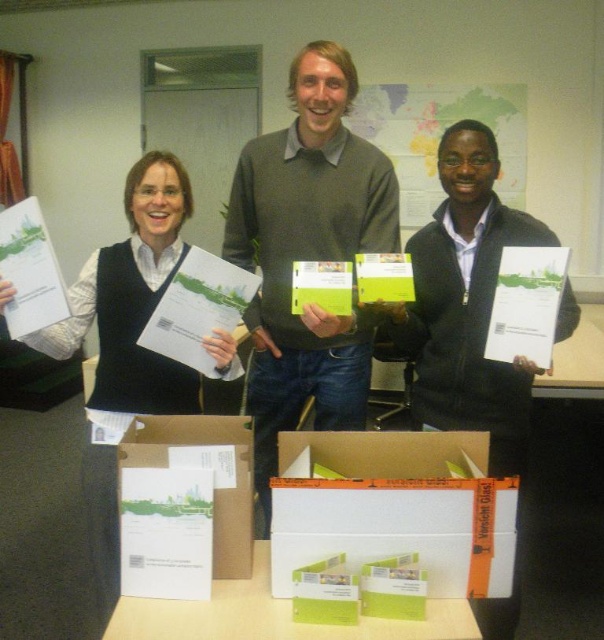
Question: Which point is closer to the camera?

Choices:
 (A) map paper at center
 (B) matte black vest at center
 (C) matte gray sweater at center
 (D) white paper at center

Answer: (D)

Question: Which of the following is the farthest from the observer?

Choices:
 (A) white cardboard table at center
 (B) white cardboard box at lower center
 (C) map paper at center

Answer: (C)

Question: Which of the following is the closest to the observer?

Choices:
 (A) (318, 115)
 (B) (600, 342)
 (C) (126, 259)

Answer: (C)

Question: Is white cardboard box at lower center bigger than map paper at center?

Choices:
 (A) no
 (B) yes

Answer: (A)

Question: Does white cardboard box at lower center lie behind matte black vest at center?

Choices:
 (A) yes
 (B) no

Answer: (B)

Question: Is the position of matte gray sweater at center more distant than that of matte black vest at center?

Choices:
 (A) yes
 (B) no

Answer: (A)